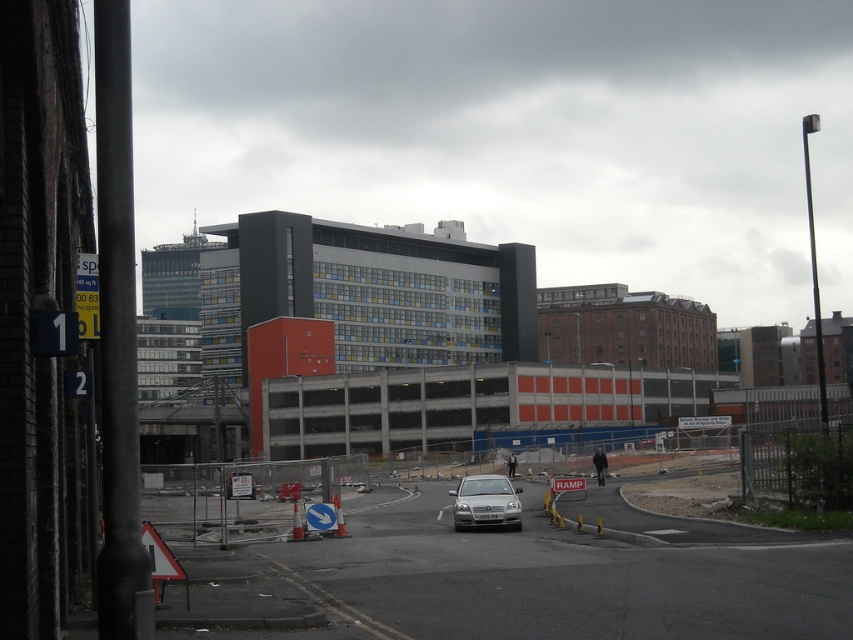
You are a city planner reviewing this urban scene. The city wants to install a new bike lane between the concrete fence at lower left and the satin silver car at center. Considering their sizes, which object might require more adjustment to accommodate the bike lane?

The concrete fence at lower left is larger in size than the satin silver car at center, so it might require more adjustment to accommodate the bike lane.

You need to park your car, which is as wide as the satin silver car at center, in a parking spot that can only accommodate vehicles narrower than the concrete fence at lower left. Will your car fit?

The concrete fence at lower left is wider than the satin silver car at center. Since the parking spot can only accommodate vehicles narrower than the concrete fence at lower left, your car, being the same width as the satin silver car at center, will fit as it is narrower than the fence.

You are a construction worker standing at the camera position. You need to place a safety barrier between the concrete fence at lower left and the camera. The safety barrier requires a minimum of 30 feet of space. Can you fit the barrier between them?

The concrete fence at lower left and camera are 33.45 feet apart, which exceeds the minimum 30 feet requirement, so the safety barrier can be placed between them.